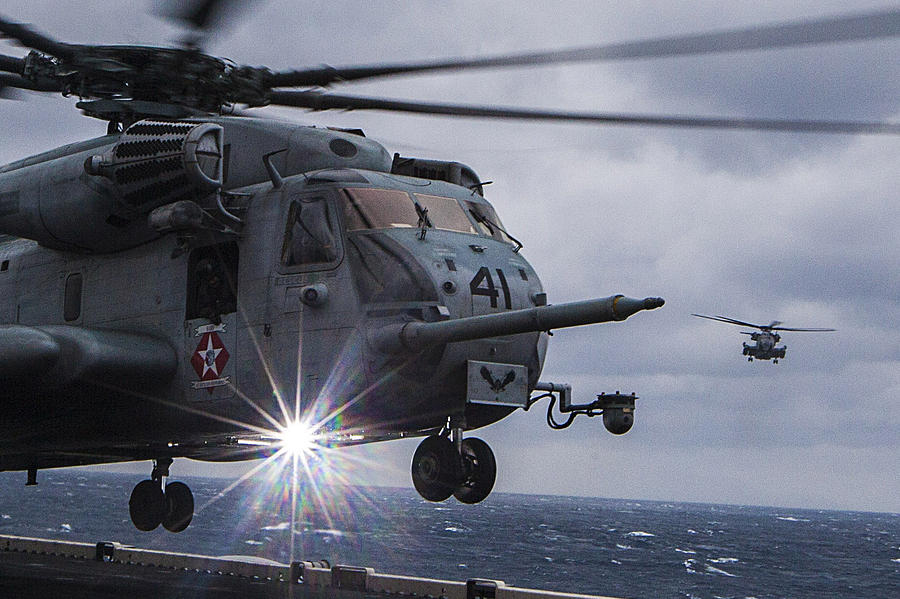
Locate an element on the screen. window is located at coordinates (310, 245), (381, 214), (444, 213).